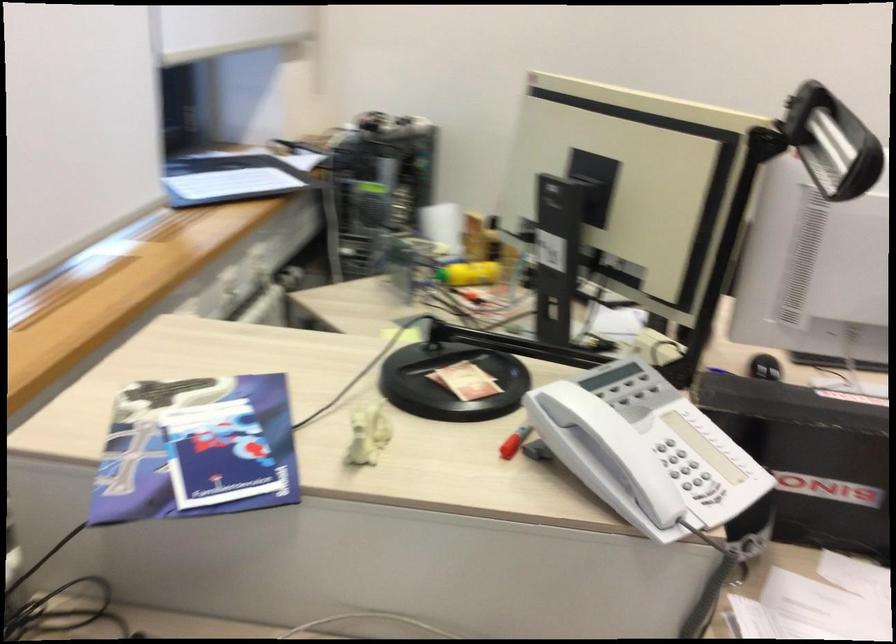
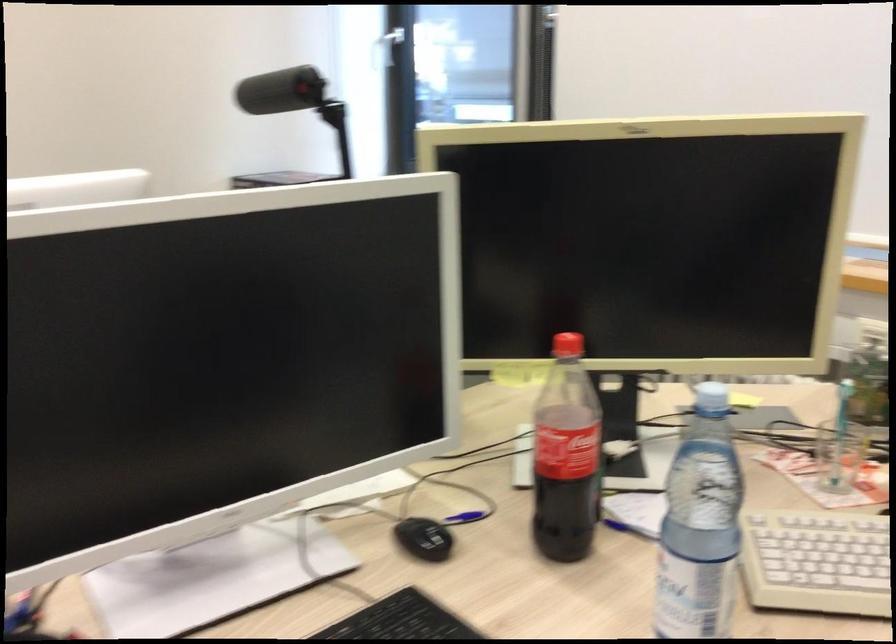
Locate, in the second image, the point that corresponds to point 776,371 in the first image.

(424, 538)